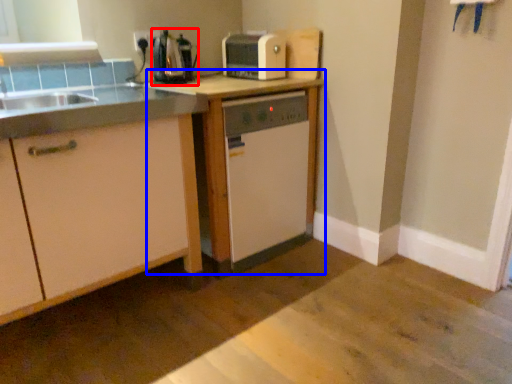
Question: Among these objects, which one is farthest to the camera, coffee machine (highlighted by a red box) or table (highlighted by a blue box)?

Choices:
 (A) coffee machine
 (B) table

Answer: (A)